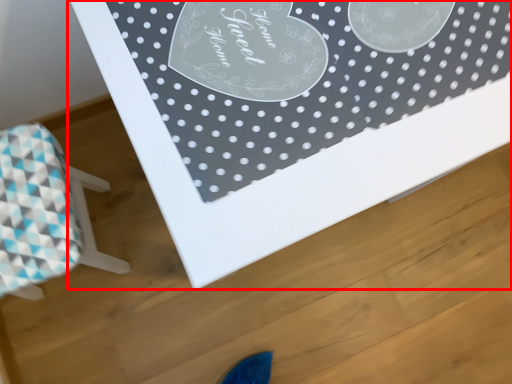
Question: From the image's perspective, where is table (annotated by the red box) located in relation to furniture in the image?

Choices:
 (A) above
 (B) below

Answer: (A)